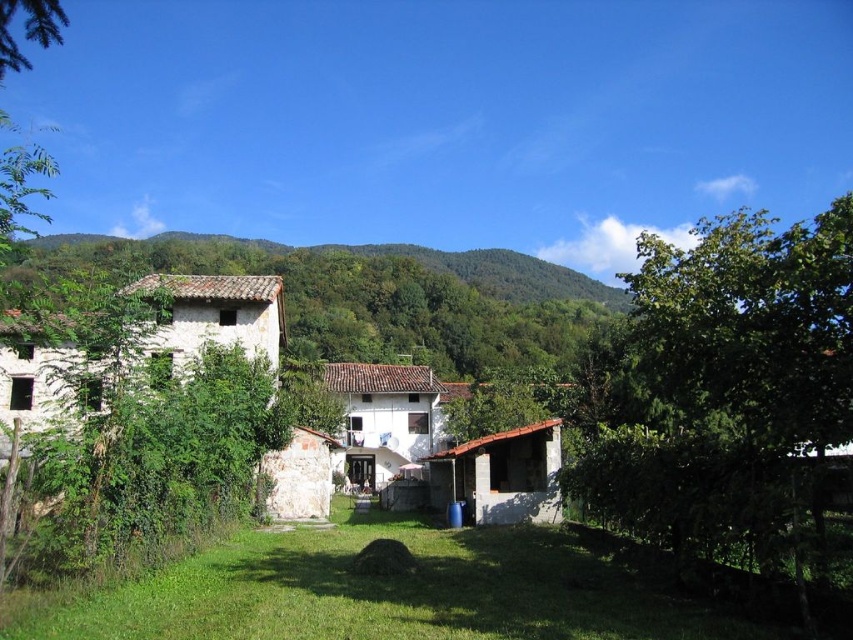
Between green leafy tree at right and green leafy tree at upper left, which one has more height?

green leafy tree at right

Between green leafy tree at right and green leafy tree at upper left, which one is positioned lower?

green leafy tree at upper left is below.

The image size is (853, 640). I want to click on green leafy tree at right, so click(730, 394).

Where is `green leafy tree at right`? Image resolution: width=853 pixels, height=640 pixels. green leafy tree at right is located at coordinates (730, 394).

Who is positioned more to the left, green leafy tree at right or green leafy hillside at left?

Positioned to the left is green leafy hillside at left.

Is point (648, 323) closer to camera compared to point (33, 264)?

Yes, it is.

Is point (819, 532) behind point (99, 237)?

No, it is in front of (99, 237).

This screenshot has height=640, width=853. In order to click on green leafy tree at right in this screenshot , I will do `click(730, 394)`.

Between green leafy hillside at left and green leafy tree at upper left, which one appears on the right side from the viewer's perspective?

green leafy tree at upper left

Between green leafy hillside at left and green leafy tree at upper left, which one is positioned lower?

green leafy hillside at left is lower down.

Locate an element on the screen. green leafy hillside at left is located at coordinates (380, 296).